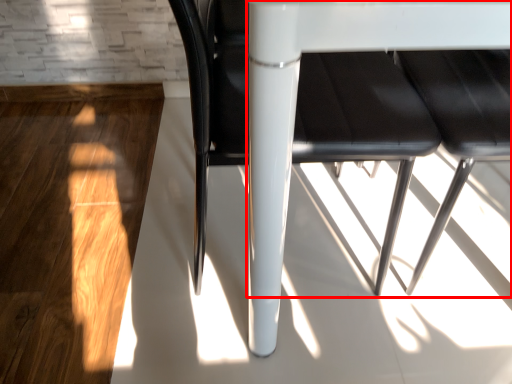
Question: Considering the relative positions of table (annotated by the red box) and chair in the image provided, where is table (annotated by the red box) located with respect to the staircase?

Choices:
 (A) right
 (B) left

Answer: (A)